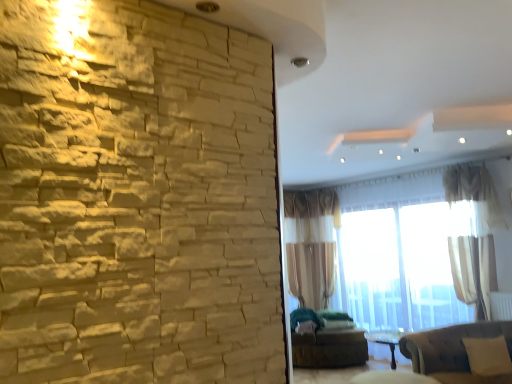
Question: Is white plastic radiator at lower right taller or shorter than white sheer curtain at upper right, marked as the 1th curtain in a front-to-back arrangement?

Choices:
 (A) tall
 (B) short

Answer: (B)

Question: From a real-world perspective, relative to white sheer curtain at upper right, marked as the 1th curtain in a front-to-back arrangement, is white plastic radiator at lower right vertically above or below?

Choices:
 (A) above
 (B) below

Answer: (B)

Question: Based on their relative distances, which object is farther from the sheer beige curtain at center, the 1th curtain positioned from the left?

Choices:
 (A) white plastic radiator at lower right
 (B) velvet brown couch at lower right
 (C) translucent fabric window at center
 (D) white sheer curtain at upper right, marked as the 2th curtain in a left-to-right arrangement
 (E) brown fabric futon at lower center

Answer: (A)

Question: Which object is the closest to the white sheer curtain at upper right, marked as the 2th curtain in a back-to-front arrangement?

Choices:
 (A) white plastic radiator at lower right
 (B) beige fabric pillow at lower right
 (C) brown fabric futon at lower center
 (D) velvet brown couch at lower right
 (E) translucent fabric window at center

Answer: (E)